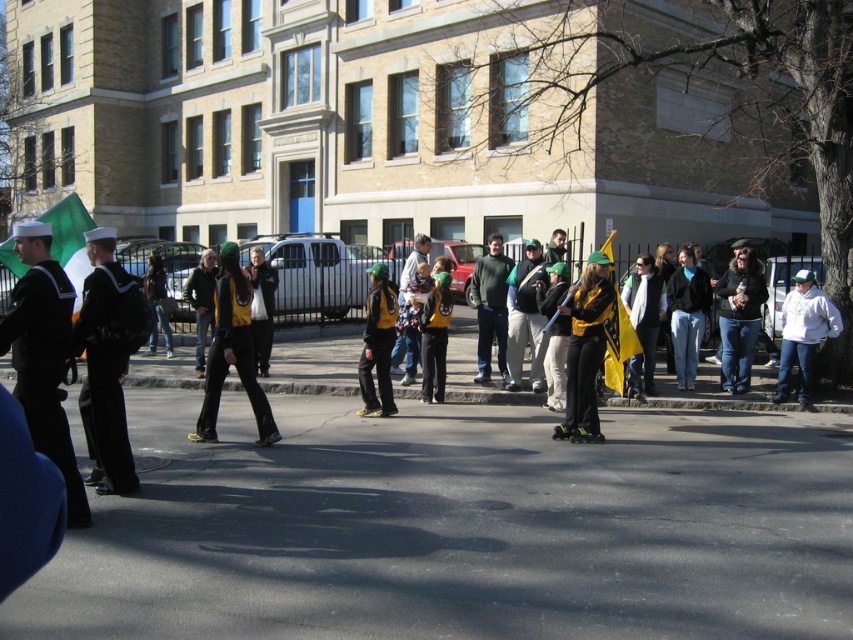
You are a photographer at the event and need to capture both the matte yellow jacket at center and the white fleece jacket at right in a single shot. Based on their positions, which jacket should you focus on first to ensure both are in frame?

The matte yellow jacket at center is above the white fleece jacket at right, so focusing on the matte yellow jacket at center first will ensure both are captured in the frame.

You are a photographer trying to capture the white fleece jacket at right and the black rubber roller skate at center in a single shot. Based on their positions, can you tell which object is closer to the camera?

The white fleece jacket at right is located above the black rubber roller skate at center, so it is closer to the camera.